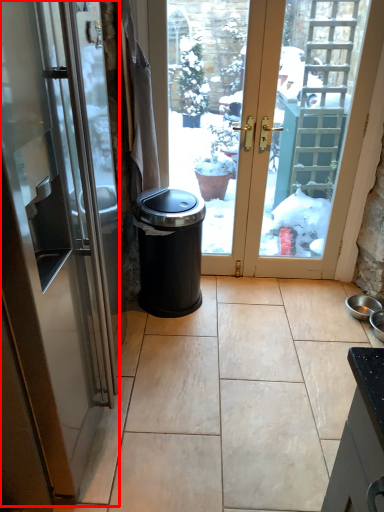
Question: Considering the relative positions of door (annotated by the red box) and waste container in the image provided, where is door (annotated by the red box) located with respect to the staircase?

Choices:
 (A) left
 (B) right

Answer: (A)